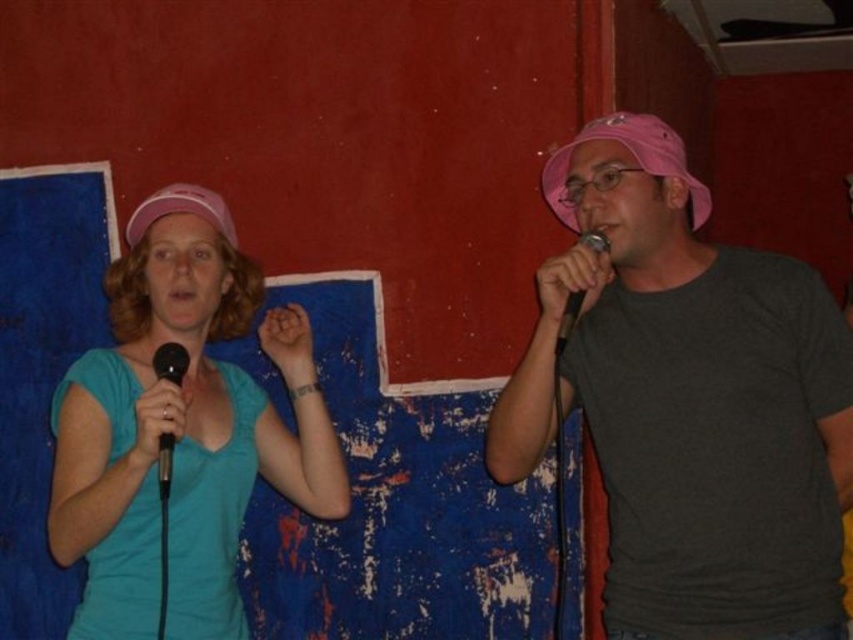
You are a photographer positioned in front of the two people. You need to capture a photo where both the black matte microphone at right and the matte pink cap at upper center are clearly visible. Given that your camera has a depth of field that can focus on objects within 10 centimeters of each other, will both objects be in focus?

The black matte microphone at right is 10.67 centimeters away from the matte pink cap at upper center. Since the distance between them exceeds the camera sensor depth of field limit of 10 centimeters, the two objects will not be in focus simultaneously.

In the scene shown: You are standing in the room and want to move from the point at coordinates point (604,237) to the point at coordinates point (614,218). Can you walk directly between them without any obstacles?

Point (604,237) is in front of point (614,218), so there is no obstacle between them. You can walk directly between them.

You are a photographer setting up for a karaoke photoshoot. You need to position a light above the black matte microphone at left and another light above the black matte microphone at right. Based on their positions, which microphone requires the light to be placed higher?

The black matte microphone at right requires the light to be placed higher because it is positioned above the black matte microphone at left.